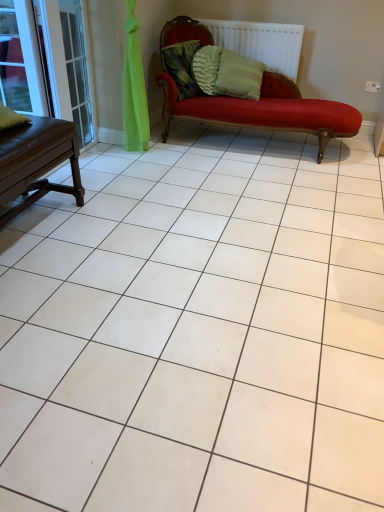
Question: From the image's perspective, does clear glass window at upper left appear higher than white textured radiator at upper center?

Choices:
 (A) no
 (B) yes

Answer: (A)

Question: Considering the relative sizes of clear glass window at upper left and white textured radiator at upper center in the image provided, is clear glass window at upper left smaller than white textured radiator at upper center?

Choices:
 (A) yes
 (B) no

Answer: (A)

Question: Considering the relative sizes of clear glass window at upper left and white textured radiator at upper center in the image provided, is clear glass window at upper left wider than white textured radiator at upper center?

Choices:
 (A) yes
 (B) no

Answer: (B)

Question: From the image's perspective, is clear glass window at upper left beneath white textured radiator at upper center?

Choices:
 (A) yes
 (B) no

Answer: (A)

Question: Can you confirm if clear glass window at upper left is shorter than white textured radiator at upper center?

Choices:
 (A) yes
 (B) no

Answer: (B)

Question: Is clear glass window at upper left aimed at white textured radiator at upper center?

Choices:
 (A) no
 (B) yes

Answer: (A)

Question: Is clear glass window at upper left positioned beyond the bounds of brown wooden table at left?

Choices:
 (A) no
 (B) yes

Answer: (B)

Question: Can you confirm if clear glass window at upper left is positioned to the right of brown wooden table at left?

Choices:
 (A) no
 (B) yes

Answer: (A)

Question: Is clear glass window at upper left surrounding brown wooden table at left?

Choices:
 (A) no
 (B) yes

Answer: (A)

Question: Is clear glass window at upper left wider than brown wooden table at left?

Choices:
 (A) yes
 (B) no

Answer: (B)

Question: Is clear glass window at upper left facing away from brown wooden table at left?

Choices:
 (A) yes
 (B) no

Answer: (B)

Question: Can you confirm if clear glass window at upper left is taller than brown wooden table at left?

Choices:
 (A) yes
 (B) no

Answer: (A)

Question: Is textured green pillow at upper center, which is the 1th pillow from left to right, further to the viewer compared to clear glass window at upper left?

Choices:
 (A) yes
 (B) no

Answer: (A)